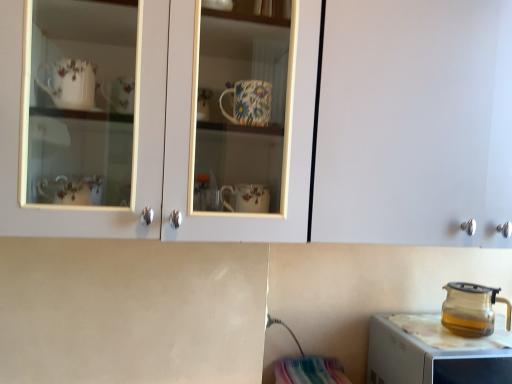
Question: Choose the correct answer: Is transparent glass kettle at lower right inside matte white cabinet at upper center or outside it?

Choices:
 (A) inside
 (B) outside

Answer: (B)

Question: From the image's perspective, is transparent glass kettle at lower right above or below matte white cabinet at upper center?

Choices:
 (A) above
 (B) below

Answer: (B)

Question: Which object is the closest to the matte white cabinet at upper center?

Choices:
 (A) transparent glass kettle at lower right
 (B) transparent glass teapot at right

Answer: (A)

Question: Estimate the real-world distances between objects in this image. Which object is closer to the transparent glass kettle at lower right?

Choices:
 (A) transparent glass teapot at right
 (B) matte white cabinet at upper center

Answer: (A)